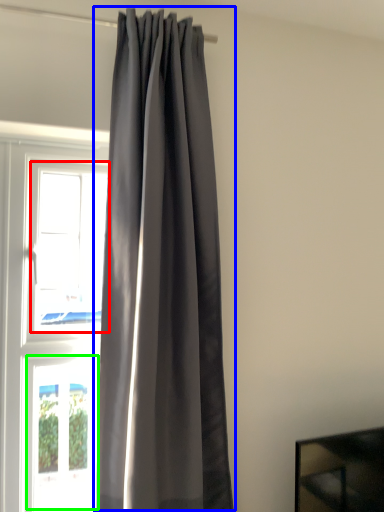
Question: Estimate the real-world distances between objects in this image. Which object is closer to window (highlighted by a red box), curtain (highlighted by a blue box) or window (highlighted by a green box)?

Choices:
 (A) curtain
 (B) window

Answer: (A)